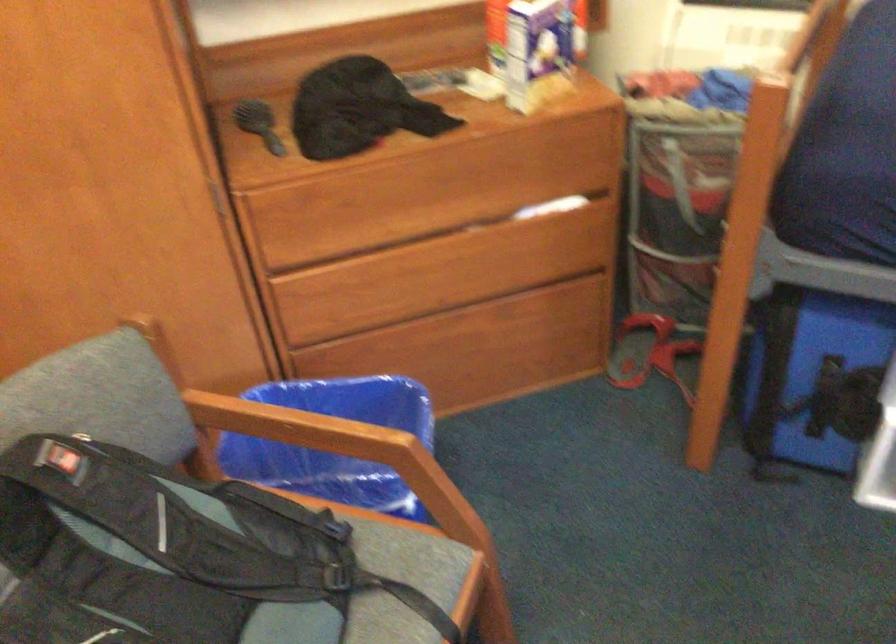
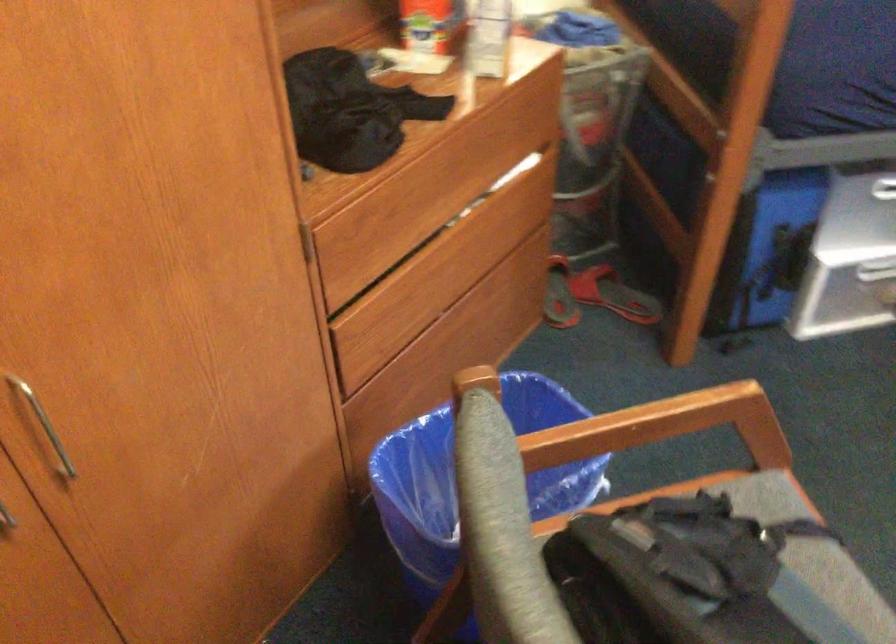
The point at (343, 444) is marked in the first image. Where is the corresponding point in the second image?

(672, 421)